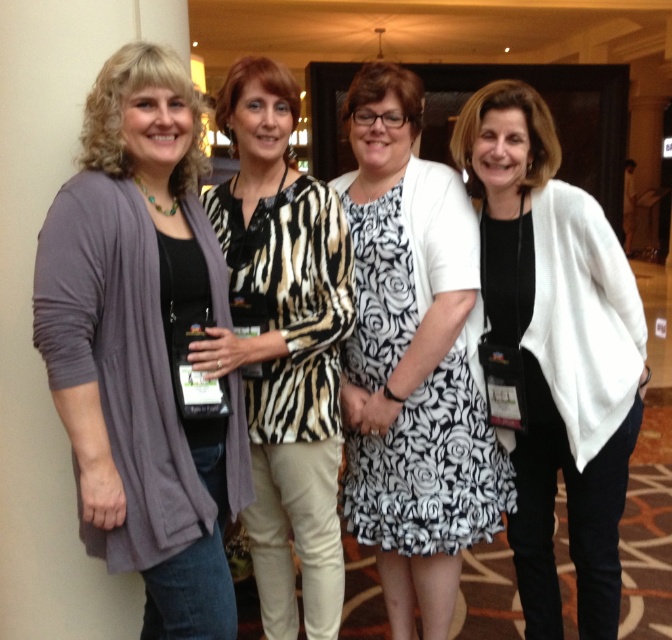
Is black floral dress at center to the left of zebra print blouse at center from the viewer's perspective?

Incorrect, black floral dress at center is not on the left side of zebra print blouse at center.

Between point (435, 481) and point (308, 394), which one is positioned in front?

Point (308, 394) is more forward.

Is point (370, 381) positioned after point (306, 262)?

Yes, point (370, 381) is behind point (306, 262).

Where is `black floral dress at center`? The image size is (672, 640). black floral dress at center is located at coordinates (413, 362).

Which is behind, point (504, 273) or point (280, 609)?

Positioned behind is point (280, 609).

Does white matte cardigan at right appear under zebra print blouse at center?

Actually, white matte cardigan at right is above zebra print blouse at center.

Locate an element on the screen. The image size is (672, 640). white matte cardigan at right is located at coordinates (552, 353).

Where is `white matte cardigan at right`? white matte cardigan at right is located at coordinates (552, 353).

What do you see at coordinates (140, 344) in the screenshot? Image resolution: width=672 pixels, height=640 pixels. I see `matte gray cardigan at left` at bounding box center [140, 344].

Which is behind, point (62, 268) or point (446, 540)?

The point (446, 540) is more distant.

Identify the location of matte gray cardigan at left. (140, 344).